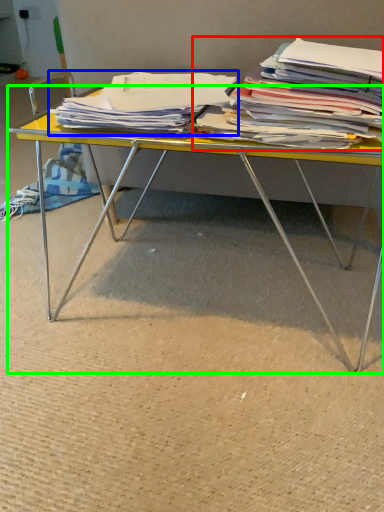
Question: Which is nearer to the magazine (highlighted by a red box)? magazine (highlighted by a blue box) or desk (highlighted by a green box).

Choices:
 (A) magazine
 (B) desk

Answer: (A)